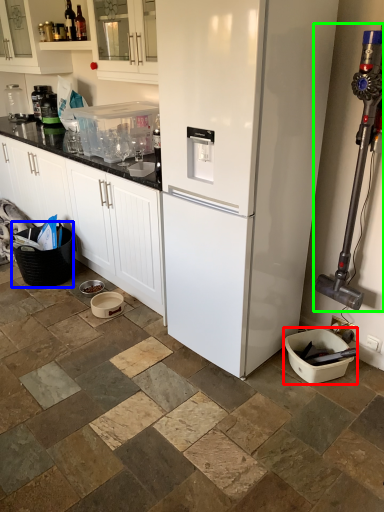
Question: Which is farther away from appliance (highlighted by a red box)? basket (highlighted by a blue box) or appliance (highlighted by a green box)?

Choices:
 (A) basket
 (B) appliance

Answer: (A)